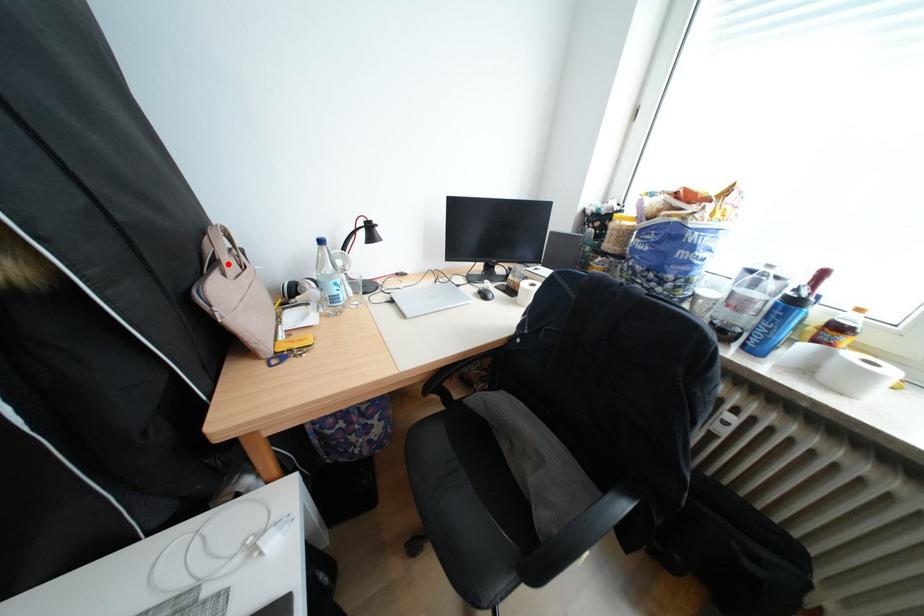
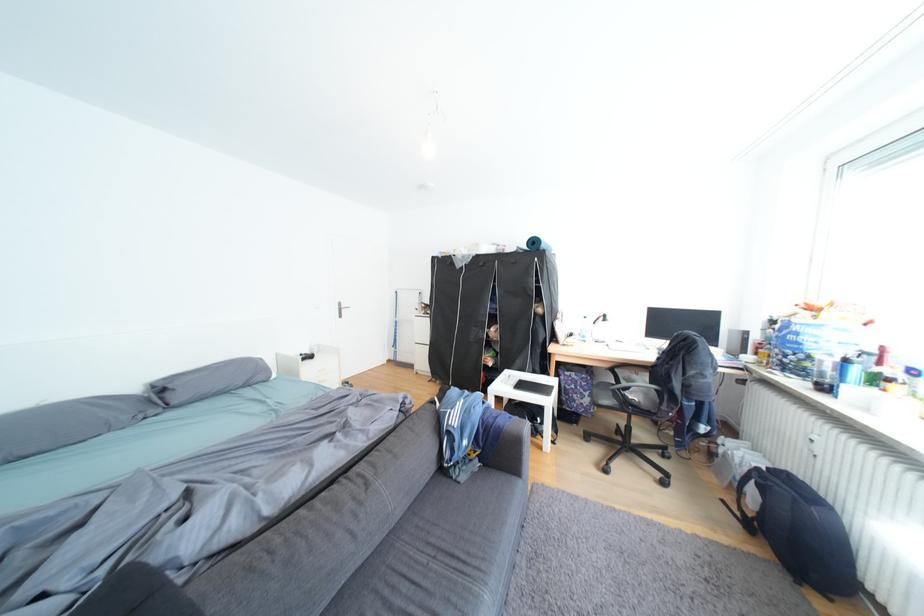
In the second image, find the point that corresponds to the highlighted location in the first image.

(570, 318)